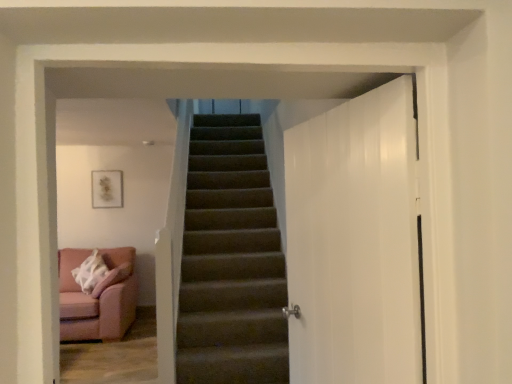
Describe the element at coordinates (354, 241) in the screenshot. I see `white glossy door at right` at that location.

You are a GUI agent. You are given a task and a screenshot of the screen. Output one action in this format:
    pyautogui.click(x=<x>, y=<y>)
    Task: Click on the white glossy door at right
    The height and width of the screenshot is (384, 512).
    Given the screenshot: What is the action you would take?
    pyautogui.click(x=354, y=241)

At what (x,y) coordinates should I click in order to perform the action: click on white glossy door at right. Please return your answer as a coordinate pair (x, y). The width and height of the screenshot is (512, 384). Looking at the image, I should click on (354, 241).